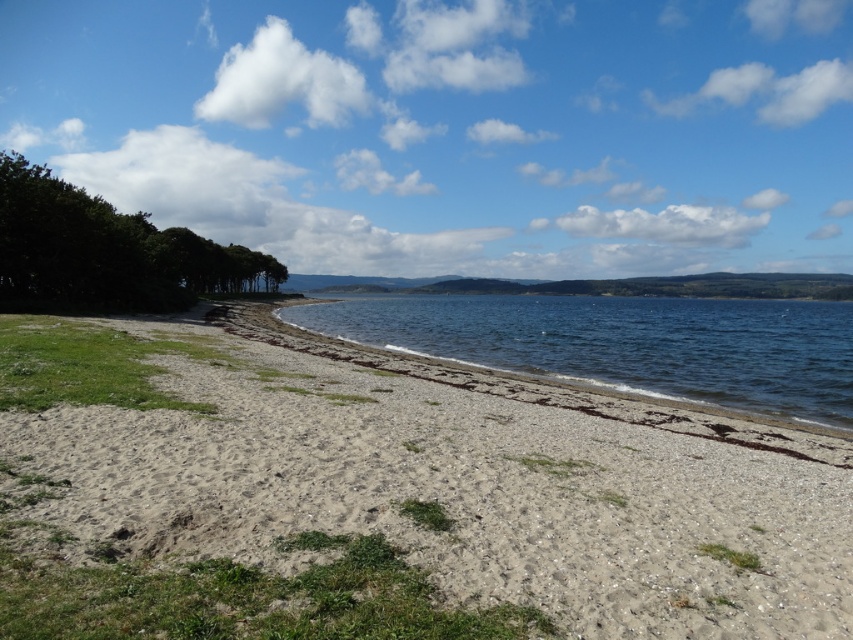
You are standing on the beach and want to walk to the water. There are clear water at center and green leafy trees at left. Which direction should you go to reach the water first?

The clear water at center is wider than the green leafy trees at left, so you should go towards the center to reach the water first.

You are standing on the beach and see the gray gravelly sand at center and the clear water at center. Which one is closer to your feet?

The gray gravelly sand at center is located below clear water at center, so the gray gravelly sand at center is closer to your feet.